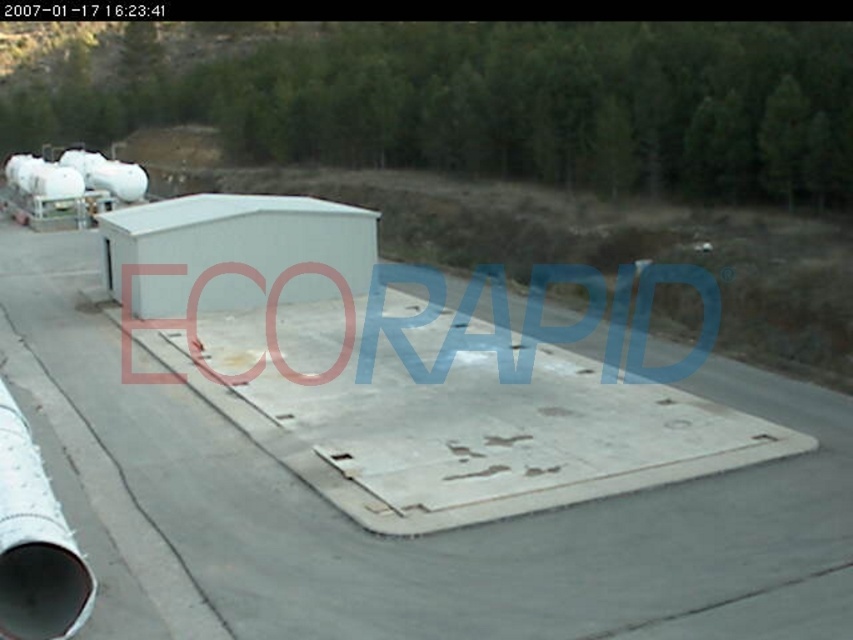
Question: Which object is the closest to the gray concrete tarmac at center?

Choices:
 (A) white metallic pipe at lower left
 (B) rusty metal ramp at center

Answer: (B)

Question: Is rusty metal ramp at center in front of white metallic pipe at lower left?

Choices:
 (A) yes
 (B) no

Answer: (B)

Question: Is rusty metal ramp at center to the right of white metallic pipe at lower left from the viewer's perspective?

Choices:
 (A) no
 (B) yes

Answer: (B)

Question: Considering the relative positions of gray concrete tarmac at center and rusty metal ramp at center in the image provided, where is gray concrete tarmac at center located with respect to rusty metal ramp at center?

Choices:
 (A) above
 (B) below

Answer: (A)

Question: Which object appears farthest from the camera in this image?

Choices:
 (A) gray concrete tarmac at center
 (B) white metallic pipe at lower left

Answer: (A)

Question: Which of the following is the closest to the observer?

Choices:
 (A) rusty metal ramp at center
 (B) gray concrete tarmac at center
 (C) white metallic pipe at lower left

Answer: (C)